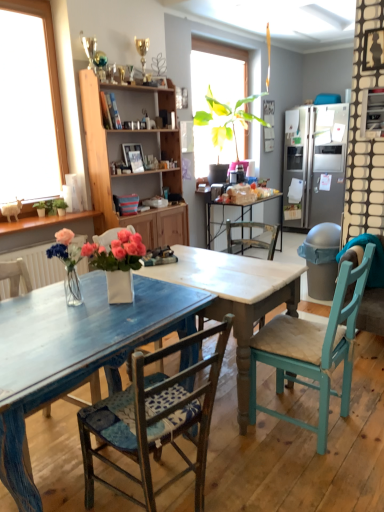
What do you see at coordinates (313, 350) in the screenshot? Image resolution: width=384 pixels, height=512 pixels. I see `teal wood chair at right, which is counted as the first chair, starting from the right` at bounding box center [313, 350].

Describe the element at coordinates (154, 419) in the screenshot. This screenshot has height=512, width=384. I see `wooden chair with blue cushion at center, arranged as the 2th chair when viewed from the left` at that location.

What is the approximate height of wooden chair with blue cushion at center, the 2th chair when ordered from right to left?

It is 35.23 inches.

In order to face satin silver refrigerator at right, should I rotate leftwards or rightwards?

To face it directly, rotate right by 17.167 degrees.

The width and height of the screenshot is (384, 512). In order to click on wooden cabinet at center in this screenshot , I will do pos(132,174).

Is there a large distance between blue painted wood table at center and teal wood chair at right, which is counted as the first chair, starting from the right?

blue painted wood table at center is actually quite close to teal wood chair at right, which is counted as the first chair, starting from the right.

From a real-world perspective, is blue painted wood table at center above or below teal wood chair at right, which is counted as the first chair, starting from the right?

In terms of real-world spatial position, blue painted wood table at center is below teal wood chair at right, which is counted as the first chair, starting from the right.

Which of these two, blue painted wood table at center or teal wood chair at right, the 3th chair from the left, is smaller?

teal wood chair at right, the 3th chair from the left.

Is blue painted wood table at center looking in the opposite direction of teal wood chair at right, the 3th chair from the left?

That's not correct — blue painted wood table at center is not looking away from teal wood chair at right, the 3th chair from the left.

Would you say teal wood chair at right, which is counted as the first chair, starting from the right, is to the left or to the right of white marble table at center in the picture?

From the image, it's evident that teal wood chair at right, which is counted as the first chair, starting from the right, is to the right of white marble table at center.

Where is `table behind the teal wood chair at right, the 3th chair from the left`? table behind the teal wood chair at right, the 3th chair from the left is located at coordinates (235, 297).

Is teal wood chair at right, the 3th chair from the left, outside of white marble table at center?

Yes, teal wood chair at right, the 3th chair from the left, is outside of white marble table at center.

From a real-world perspective, is white marble table at center physically located above or below satin silver refrigerator at right?

white marble table at center is below satin silver refrigerator at right.

Which is more to the left, white marble table at center or satin silver refrigerator at right?

white marble table at center is more to the left.

Does white marble table at center have a smaller size compared to satin silver refrigerator at right?

Correct, white marble table at center occupies less space than satin silver refrigerator at right.

Does white marble table at center come in front of satin silver refrigerator at right?

Yes, it is in front of satin silver refrigerator at right.

You are a GUI agent. You are given a task and a screenshot of the screen. Output one action in this format:
    pyautogui.click(x=<x>, y=<y>)
    Task: Click on the 1st chair directly beneath the satin silver refrigerator at right (from a real-world perspective)
    Image resolution: width=384 pixels, height=512 pixels.
    Given the screenshot: What is the action you would take?
    pyautogui.click(x=313, y=350)

From the image's perspective, would you say teal wood chair at right, the 3th chair from the left, is shown under satin silver refrigerator at right?

Correct, teal wood chair at right, the 3th chair from the left, appears lower than satin silver refrigerator at right in the image.

Does point (321, 351) lie behind point (320, 210)?

No, (321, 351) is in front of (320, 210).

From a real-world perspective, is blue painted wood table at center on wooden cabinet at center?

Incorrect, from a real-world perspective, blue painted wood table at center is lower than wooden cabinet at center.

Is blue painted wood table at center facing towards wooden cabinet at center?

No, blue painted wood table at center does not turn towards wooden cabinet at center.

Based on the photo, is blue painted wood table at center behind wooden cabinet at center?

That is False.

Is blue painted wood table at center bigger than wooden cabinet at center?

No, blue painted wood table at center is not bigger than wooden cabinet at center.

Considering the positions of objects white marble table at center and wooden chair with blue cushion at center, arranged as the 2th chair when viewed from the left, in the image provided, who is more to the left, white marble table at center or wooden chair with blue cushion at center, arranged as the 2th chair when viewed from the left,?

From the viewer's perspective, wooden chair with blue cushion at center, arranged as the 2th chair when viewed from the left, appears more on the left side.

Does white marble table at center touch wooden chair with blue cushion at center, the 2th chair when ordered from right to left?

They are not placed beside each other.

Considering the relative positions of white marble table at center and wooden chair with blue cushion at center, the 2th chair when ordered from right to left, in the image provided, is white marble table at center in front of wooden chair with blue cushion at center, the 2th chair when ordered from right to left,?

No, white marble table at center is further to the viewer.

Is white marble table at center turned away from wooden chair with blue cushion at center, the 2th chair when ordered from right to left?

white marble table at center does not have its back to wooden chair with blue cushion at center, the 2th chair when ordered from right to left.

Who is smaller, wooden cabinet at center or distressed blue chair at lower left, which appears as the 3th chair when viewed from the right?

With smaller size is distressed blue chair at lower left, which appears as the 3th chair when viewed from the right.

From a real-world perspective, is wooden cabinet at center positioned over distressed blue chair at lower left, which appears as the 3th chair when viewed from the right, based on gravity?

Correct, in the physical world, wooden cabinet at center is higher than distressed blue chair at lower left, which appears as the 3th chair when viewed from the right.

Does wooden cabinet at center turn towards distressed blue chair at lower left, which appears as the 3th chair when viewed from the right?

No, wooden cabinet at center is not facing towards distressed blue chair at lower left, which appears as the 3th chair when viewed from the right.

Which of these two, wooden cabinet at center or distressed blue chair at lower left, which appears as the 3th chair when viewed from the right, stands taller?

Standing taller between the two is wooden cabinet at center.

I want to click on the 3rd chair positioned above the blue painted wood table at center (from a real-world perspective), so click(313, 350).

Image resolution: width=384 pixels, height=512 pixels. In order to click on chair above the white marble table at center (from the image's perspective) in this screenshot , I will do `click(313, 350)`.

Consider the image. When comparing their distances from teal wood chair at right, which is counted as the first chair, starting from the right, does blue painted wood table at center or satin silver refrigerator at right seem further?

satin silver refrigerator at right.

Looking at the image, which one is located closer to satin silver refrigerator at right, white marble table at center or teal wood chair at right, the 3th chair from the left?

white marble table at center lies closer to satin silver refrigerator at right than the other object.

Estimate the real-world distances between objects in this image. Which object is closer to wooden chair with blue cushion at center, arranged as the 2th chair when viewed from the left, wooden cabinet at center or blue painted wood table at center?

blue painted wood table at center is closer to wooden chair with blue cushion at center, arranged as the 2th chair when viewed from the left.

Consider the image. Which object lies nearer to the anchor point teal wood chair at right, which is counted as the first chair, starting from the right, wooden chair with blue cushion at center, the 2th chair when ordered from right to left, or wooden cabinet at center?

wooden chair with blue cushion at center, the 2th chair when ordered from right to left, is positioned closer to the anchor teal wood chair at right, which is counted as the first chair, starting from the right.

Estimate the real-world distances between objects in this image. Which object is closer to distressed blue chair at lower left, the first chair positioned from the left, blue painted wood table at center or white marble table at center?

Answer: The object closer to distressed blue chair at lower left, the first chair positioned from the left, is blue painted wood table at center.

When comparing their distances from distressed blue chair at lower left, which appears as the 3th chair when viewed from the right, does white marble table at center or satin silver refrigerator at right seem closer?

white marble table at center is positioned closer to the anchor distressed blue chair at lower left, which appears as the 3th chair when viewed from the right.

From the image, which object appears to be nearer to distressed blue chair at lower left, the first chair positioned from the left, teal wood chair at right, the 3th chair from the left, or blue painted wood table at center?

The object closer to distressed blue chair at lower left, the first chair positioned from the left, is blue painted wood table at center.

Looking at the image, which one is located closer to wooden chair with blue cushion at center, the 2th chair when ordered from right to left, teal wood chair at right, the 3th chair from the left, or satin silver refrigerator at right?

Based on the image, teal wood chair at right, the 3th chair from the left, appears to be nearer to wooden chair with blue cushion at center, the 2th chair when ordered from right to left.

At what (x,y) coordinates should I click in order to perform the action: click on table between wooden chair with blue cushion at center, arranged as the 2th chair when viewed from the left, and teal wood chair at right, which is counted as the first chair, starting from the right, in the horizontal direction. Please return your answer as a coordinate pair (x, y). Looking at the image, I should click on (235, 297).

Find the location of a particular element. The image size is (384, 512). kitchen & dining room table situated between wooden chair with blue cushion at center, arranged as the 2th chair when viewed from the left, and teal wood chair at right, which is counted as the first chair, starting from the right, from left to right is located at coordinates (123, 335).

Image resolution: width=384 pixels, height=512 pixels. Find the location of `kitchen & dining room table between distressed blue chair at lower left, which appears as the 3th chair when viewed from the right, and teal wood chair at right, the 3th chair from the left, in the horizontal direction`. kitchen & dining room table between distressed blue chair at lower left, which appears as the 3th chair when viewed from the right, and teal wood chair at right, the 3th chair from the left, in the horizontal direction is located at coordinates (123, 335).

At what (x,y) coordinates should I click in order to perform the action: click on cabinetry between distressed blue chair at lower left, which appears as the 3th chair when viewed from the right, and satin silver refrigerator at right from front to back. Please return your answer as a coordinate pair (x, y). This screenshot has height=512, width=384. Looking at the image, I should click on (132, 174).